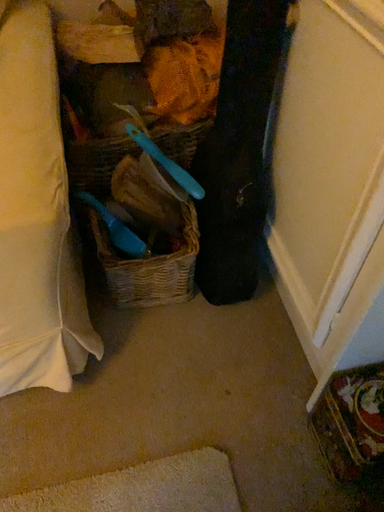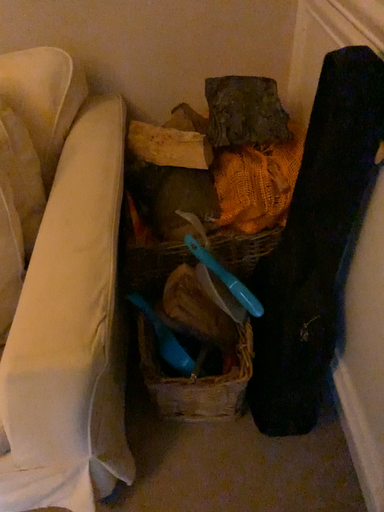
Question: How did the camera likely rotate when shooting the video?

Choices:
 (A) rotated left
 (B) rotated right

Answer: (A)